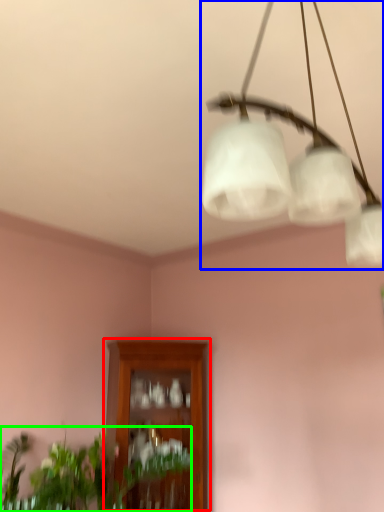
Question: Estimate the real-world distances between objects in this image. Which object is farther from cabinetry (highlighted by a red box), lamp (highlighted by a blue box) or houseplant (highlighted by a green box)?

Choices:
 (A) lamp
 (B) houseplant

Answer: (A)